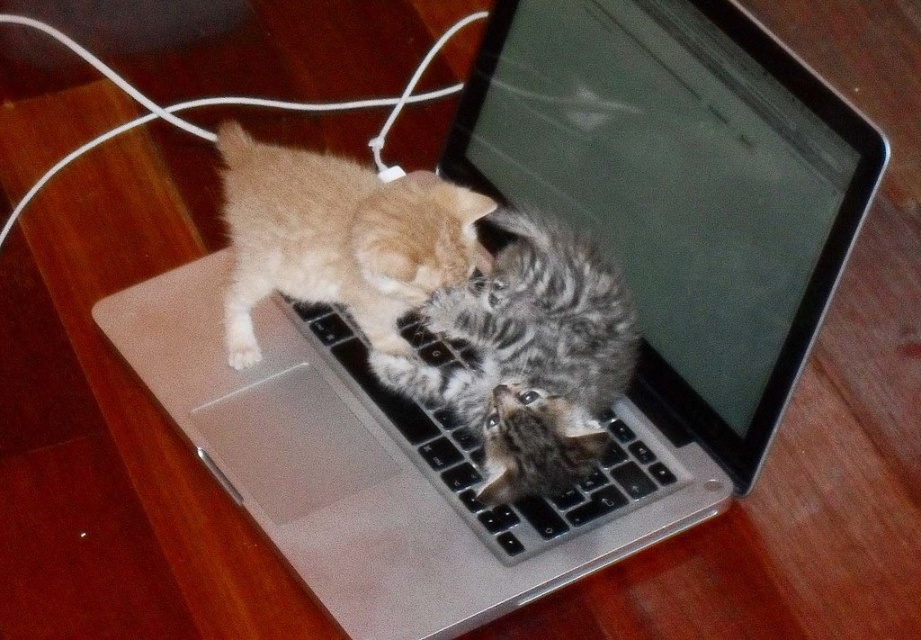
Between gray tabby kitten at center and black plastic keyboard at center, which one has more height?

gray tabby kitten at center is taller.

Is gray tabby kitten at center thinner than black plastic keyboard at center?

Correct, gray tabby kitten at center's width is less than black plastic keyboard at center's.

Who is more distant from viewer, (510,490) or (460,444)?

The point (460,444) is more distant.

You are a GUI agent. You are given a task and a screenshot of the screen. Output one action in this format:
    pyautogui.click(x=<x>, y=<y>)
    Task: Click on the gray tabby kitten at center
    The height and width of the screenshot is (640, 921).
    Given the screenshot: What is the action you would take?
    pyautogui.click(x=529, y=356)

Between tabby fur kitten at center and black plastic keyboard at center, which one appears on the right side from the viewer's perspective?

black plastic keyboard at center is more to the right.

Who is more distant from viewer, (x=301, y=220) or (x=469, y=497)?

Point (x=301, y=220)

Find the location of a particular element. The width and height of the screenshot is (921, 640). tabby fur kitten at center is located at coordinates (337, 237).

This screenshot has width=921, height=640. Find the location of `tabby fur kitten at center`. tabby fur kitten at center is located at coordinates (337, 237).

Does gray tabby kitten at center lie behind tabby fur kitten at center?

Yes, it is.

Is point (528, 257) positioned behind point (227, 342)?

No.

Describe the element at coordinates (529, 356) in the screenshot. I see `gray tabby kitten at center` at that location.

Image resolution: width=921 pixels, height=640 pixels. What are the coordinates of `gray tabby kitten at center` in the screenshot? It's located at (529, 356).